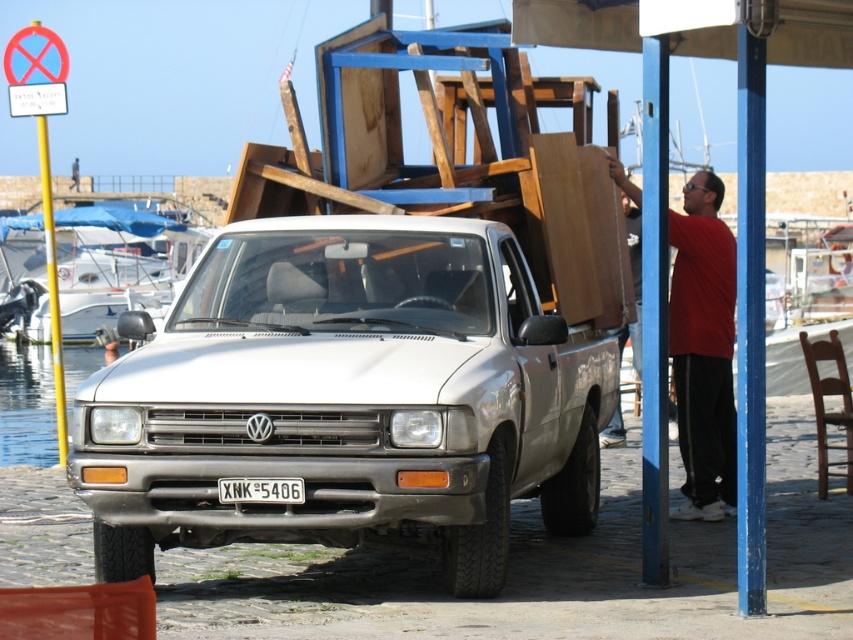
You are standing at the marina and see the red cotton shirt at right and the clear water at lower left. Which object is closer to you?

The red cotton shirt at right is closer to you because it is in front of the clear water at lower left.

You are a delivery driver who just arrived at the marina with a large wooden table. You need to unload it from the white matte truck at center. Considering the space available, can you safely place the table near the clear water at lower left without blocking the truck?

The white matte truck at center is smaller than clear water at lower left, so there should be enough space to safely place the table near the clear water at lower left without blocking the truck.

You are standing in the marina area and want to know which of the two points, point (556, 445) or point (722, 481), is closer to you. Can you determine this based on the scene?

Point (556, 445) is closer to the viewer than point (722, 481).